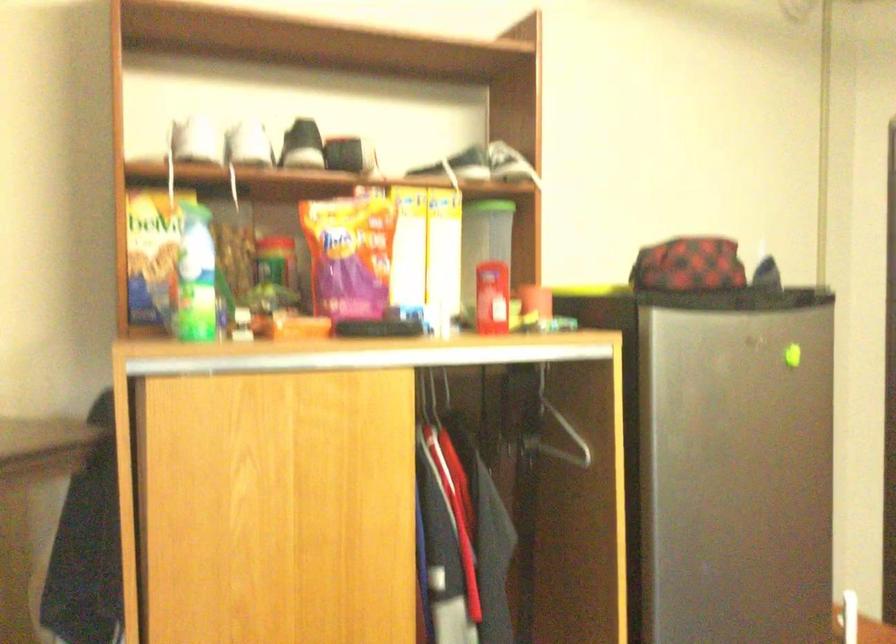
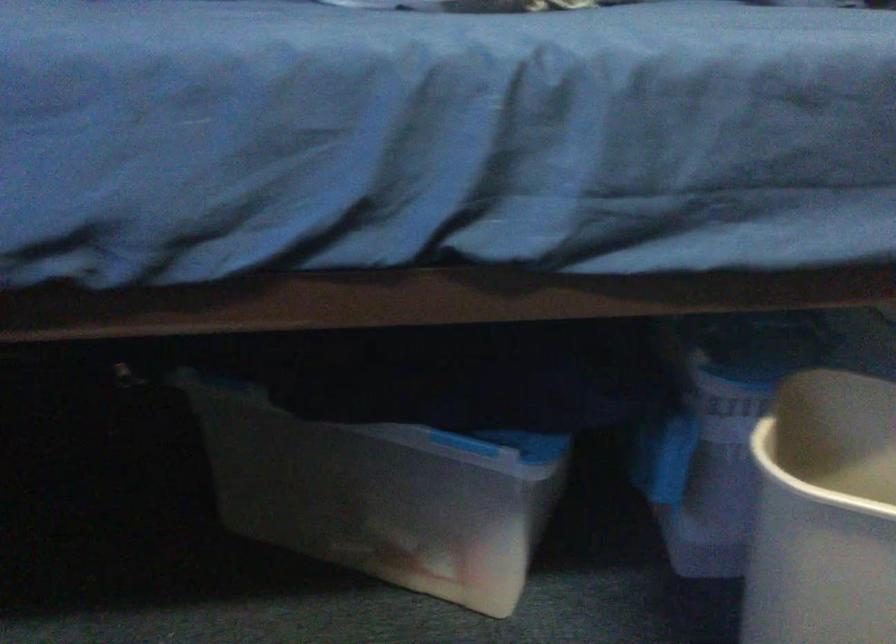
Based on the continuous images, in which direction is the camera rotating?

The camera's rotation is toward left-down.